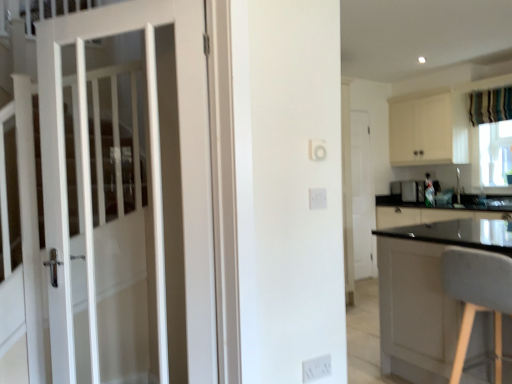
Question: Is the position of transparent plastic window screen at right more distant than that of gray fabric chair at right?

Choices:
 (A) no
 (B) yes

Answer: (B)

Question: Is transparent plastic window screen at right smaller than gray fabric chair at right?

Choices:
 (A) no
 (B) yes

Answer: (B)

Question: Can you confirm if transparent plastic window screen at right is positioned to the left of gray fabric chair at right?

Choices:
 (A) yes
 (B) no

Answer: (B)

Question: Is transparent plastic window screen at right far away from gray fabric chair at right?

Choices:
 (A) yes
 (B) no

Answer: (A)

Question: Is transparent plastic window screen at right taller than gray fabric chair at right?

Choices:
 (A) no
 (B) yes

Answer: (A)

Question: Looking at the image, does metallic silver toaster at right seem bigger or smaller compared to white plastic electric outlet at lower center?

Choices:
 (A) big
 (B) small

Answer: (A)

Question: In the image, is metallic silver toaster at right positioned in front of or behind white plastic electric outlet at lower center?

Choices:
 (A) front
 (B) behind

Answer: (B)

Question: In terms of width, does metallic silver toaster at right look wider or thinner when compared to white plastic electric outlet at lower center?

Choices:
 (A) thin
 (B) wide

Answer: (B)

Question: From the image's perspective, is metallic silver toaster at right above or below white plastic electric outlet at lower center?

Choices:
 (A) below
 (B) above

Answer: (B)

Question: Considering the positions of white wooden door at left, which is counted as the 1th door, starting from the front, and striped fabric curtain at upper right in the image, is white wooden door at left, which is counted as the 1th door, starting from the front, wider or thinner than striped fabric curtain at upper right?

Choices:
 (A) wide
 (B) thin

Answer: (A)

Question: Based on their positions, is white wooden door at left, the 2th door when ordered from back to front, located to the left or right of striped fabric curtain at upper right?

Choices:
 (A) left
 (B) right

Answer: (A)

Question: Would you say white wooden door at left, which is counted as the 1th door, starting from the front, is inside or outside striped fabric curtain at upper right?

Choices:
 (A) inside
 (B) outside

Answer: (B)

Question: Is white wooden door at left, the 1th door in the left-to-right sequence, in front of or behind striped fabric curtain at upper right in the image?

Choices:
 (A) behind
 (B) front

Answer: (B)

Question: Would you say gray fabric chair at right is inside or outside white matte door at center, marked as the 2th door in a front-to-back arrangement?

Choices:
 (A) outside
 (B) inside

Answer: (A)

Question: From the image's perspective, relative to white matte door at center, the 2th door positioned from the left, is gray fabric chair at right above or below?

Choices:
 (A) below
 (B) above

Answer: (A)